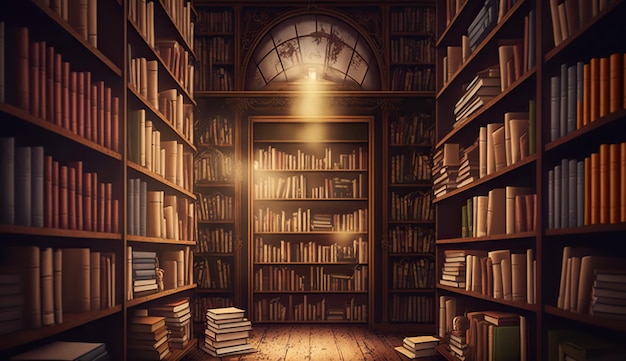
Find the location of a particular element. Image resolution: width=626 pixels, height=361 pixels. wood planks floring is located at coordinates (257, 328), (275, 336), (304, 342), (330, 342), (351, 342), (374, 341), (399, 331), (426, 329).